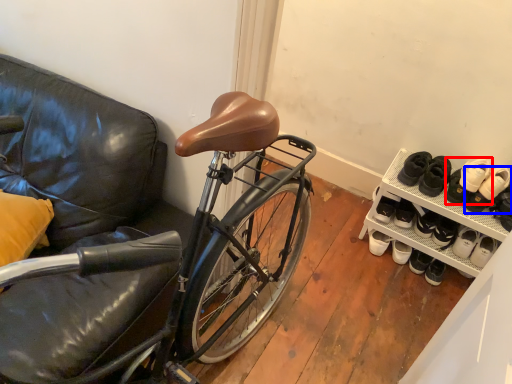
Question: Which object is closer to the camera taking this photo, footwear (highlighted by a red box) or footwear (highlighted by a blue box)?

Choices:
 (A) footwear
 (B) footwear

Answer: (B)